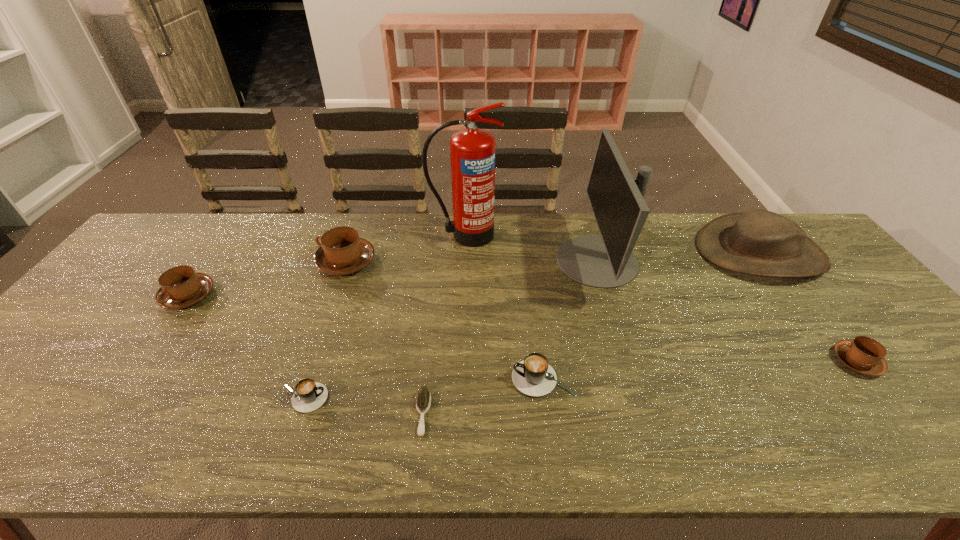
What are the coordinates of `vacant point located on the side of the nearest brown cappuccino with the handle` in the screenshot? It's located at (793, 361).

Where is `vacant space located on the side of the nearest brown cappuccino with the handle`? vacant space located on the side of the nearest brown cappuccino with the handle is located at coordinates (789, 361).

Locate an element on the screen. The width and height of the screenshot is (960, 540). blank area located with the handle on the side of the shortest cappuccino is located at coordinates (479, 398).

This screenshot has height=540, width=960. I want to click on free space located 0.190m on the back of the scrubbing brush, so click(432, 327).

You are a GUI agent. You are given a task and a screenshot of the screen. Output one action in this format:
    pyautogui.click(x=<x>, y=<y>)
    Task: Click on the fire extinguisher present at the far edge
    
    Given the screenshot: What is the action you would take?
    pyautogui.click(x=472, y=151)

Locate an element on the screen. Image resolution: width=960 pixels, height=540 pixels. computer monitor that is at the far edge is located at coordinates click(617, 200).

What are the coordinates of `cowboy hat that is positioned at the far edge` in the screenshot? It's located at (758, 242).

Find the location of `cappuccino present at the far edge`. cappuccino present at the far edge is located at coordinates (342, 252).

Locate an element on the screen. The height and width of the screenshot is (540, 960). object that is at the near edge is located at coordinates (423, 401).

Identify the location of cowboy hat at the right edge. (758, 242).